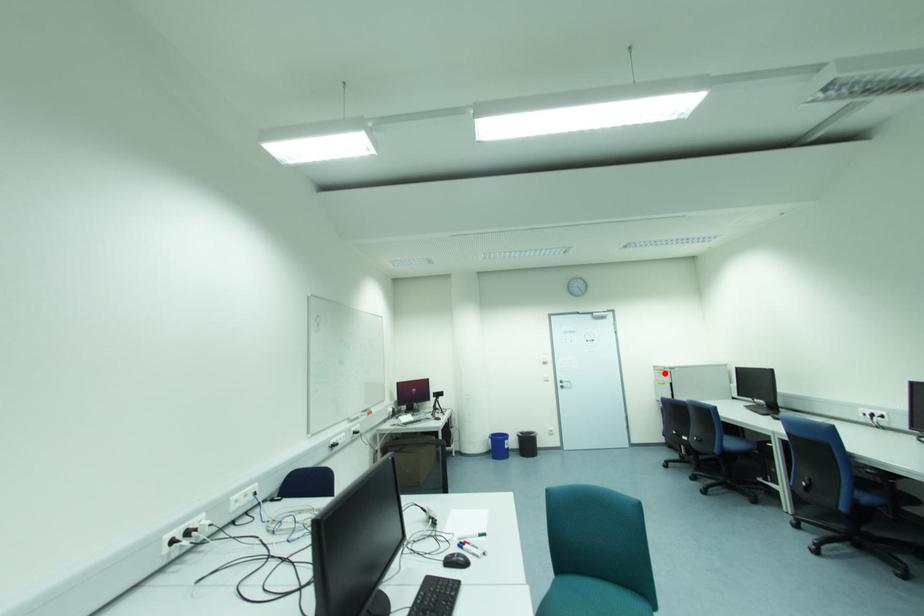
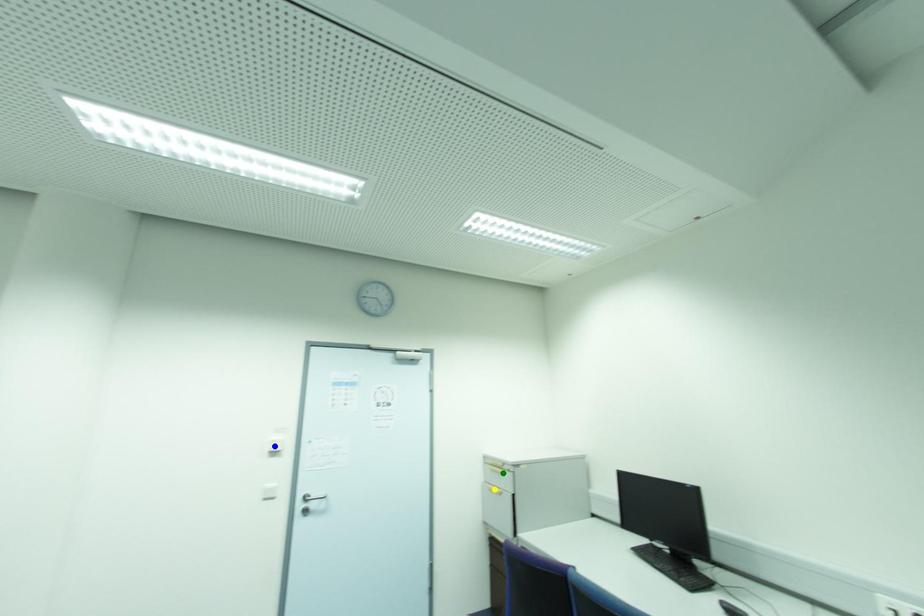
Question: I am providing you with two images of the same scene from different viewpoints. A red point is marked on the first image. You are given multiple points on the second image. Which point in image 2 is actually the same real-world point as the red point in image 1?

Choices:
 (A) blue point
 (B) yellow point
 (C) green point

Answer: (C)